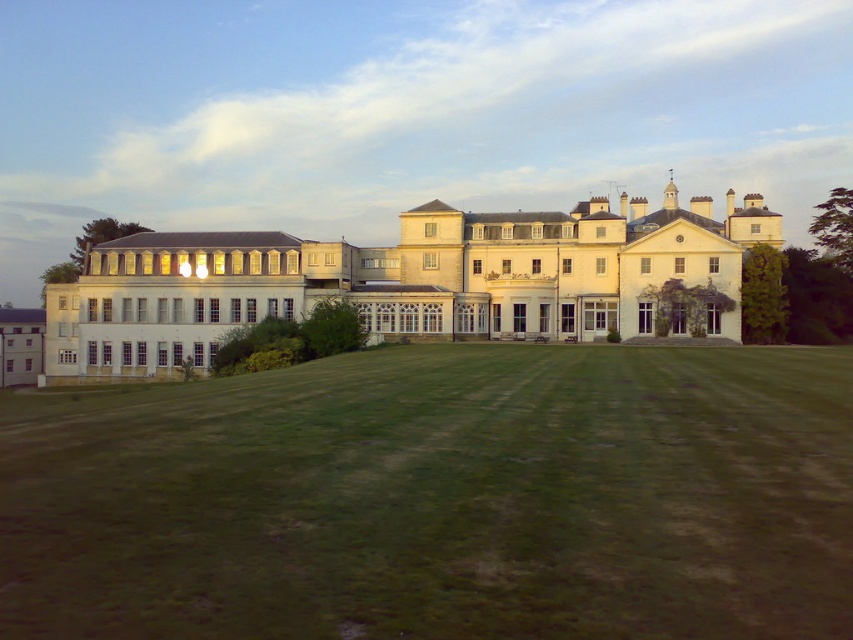
Can you confirm if green grass at center is thinner than white smooth mansion at center?

Yes.

Is green grass at center above white smooth mansion at center?

No, green grass at center is not above white smooth mansion at center.

What do you see at coordinates (440, 499) in the screenshot?
I see `green grass at center` at bounding box center [440, 499].

You are a GUI agent. You are given a task and a screenshot of the screen. Output one action in this format:
    pyautogui.click(x=<x>, y=<y>)
    Task: Click on the green grass at center
    The image size is (853, 640).
    Given the screenshot: What is the action you would take?
    pyautogui.click(x=440, y=499)